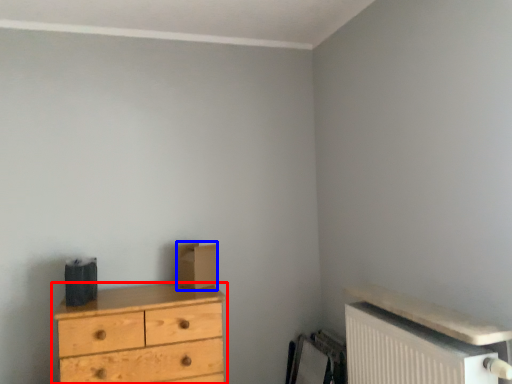
Question: Which object is closer to the camera taking this photo, chest of drawers (highlighted by a red box) or cardboard box (highlighted by a blue box)?

Choices:
 (A) chest of drawers
 (B) cardboard box

Answer: (A)